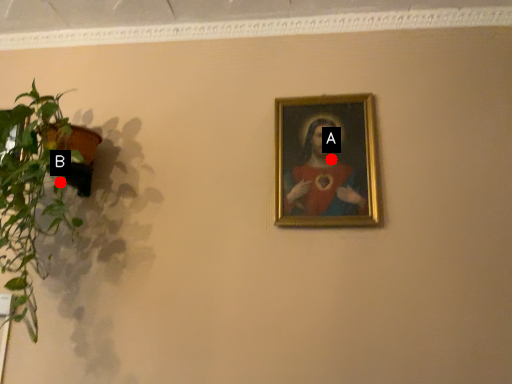
Question: Two points are circled on the image, labeled by A and B beside each circle. Which point appears closest to the camera in this image?

Choices:
 (A) A is closer
 (B) B is closer

Answer: (B)